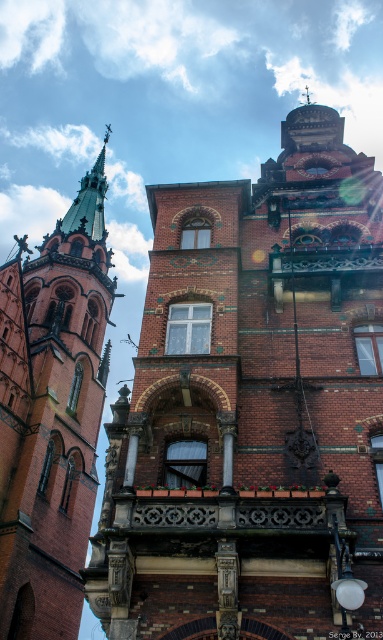
Who is higher up, brick building at center or brick spire at left?

Positioned higher is brick spire at left.

Consider the image. Can you confirm if brick building at center is thinner than brick spire at left?

Incorrect, brick building at center's width is not less than brick spire at left's.

What are the coordinates of `brick building at center` in the screenshot? It's located at (252, 404).

I want to click on brick building at center, so click(x=252, y=404).